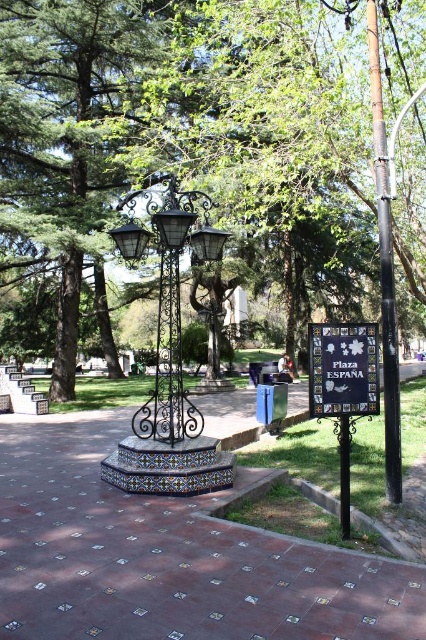
From the picture: You are a visitor in the park and want to walk from the black matte pole at right to the black plastic sign at center. Which direction should you move in to get closer to the sign?

You should move towards the black plastic sign at center because it is closer to you than the black matte pole at right, so moving towards it would bring you closer.

You are designing a pathway in a park and need to place a bench between the black matte pole at right and the black plastic sign at center. Given that the bench requires 1.2 meters of space, can the available space between them accommodate the bench?

The black matte pole at right is narrower than the black plastic sign at center, but the description does not provide specific distance information between them. Therefore, it is impossible to determine if the bench will fit based on the given details.